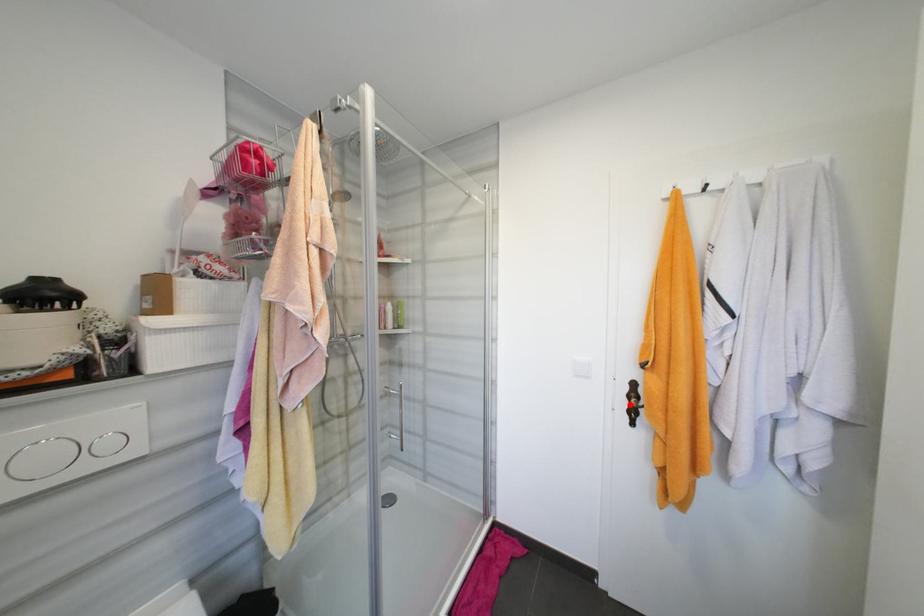
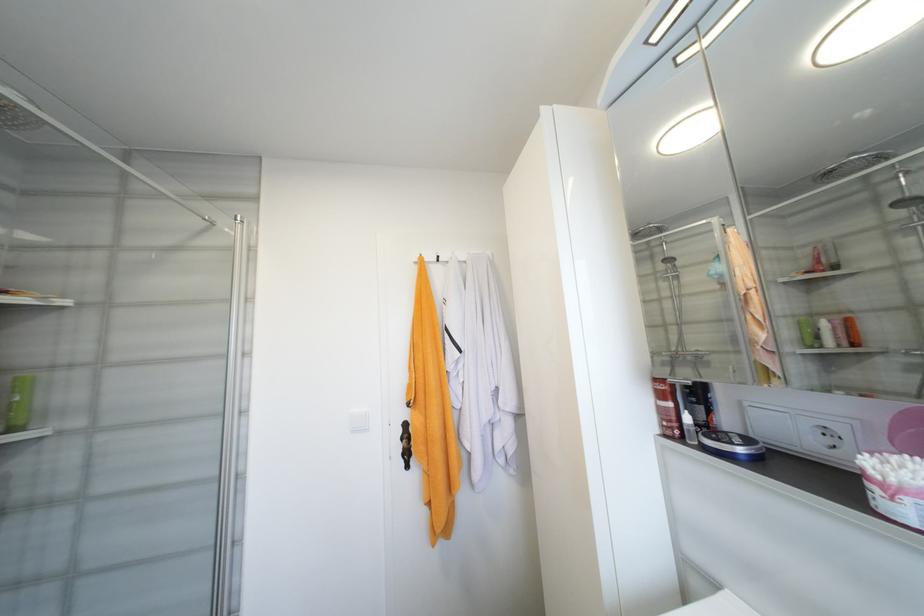
Find the pixel in the second image that matches the highlighted location in the first image.

(405, 448)